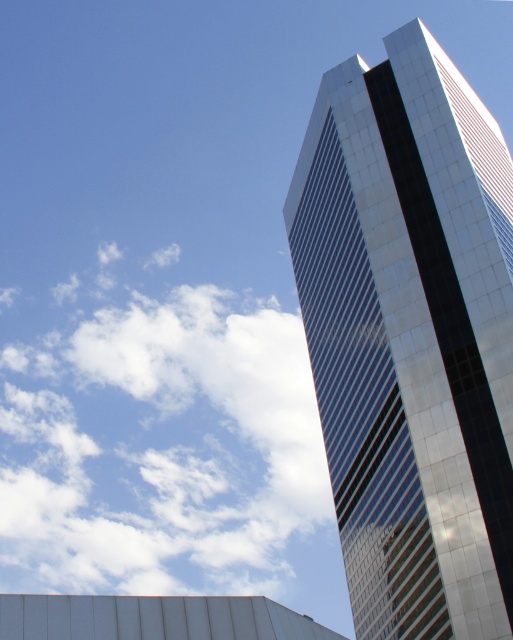
You are an architect reviewing a cityscape design. You notice the glossy glass tower at upper right and the white fluffy cloud at upper left. Based on their positions, which object appears closer to the viewer in the image?

The glossy glass tower at upper right appears closer to the viewer because it is positioned in front of the white fluffy cloud at upper left.

You are standing in the middle of a city square and looking up at the skyscraper. You want to take a photo of the glossy glass tower at upper right. Where exactly should you aim your camera to capture it?

You should aim your camera at point coordinates of (410, 337) to capture the glossy glass tower at upper right.

You are a photographer trying to capture the glossy glass tower at upper right and the white fluffy cloud at upper left in the same frame. Based on their sizes in the image, which one appears smaller?

The glossy glass tower at upper right appears smaller than the white fluffy cloud at upper left because its width is less than the cloud.